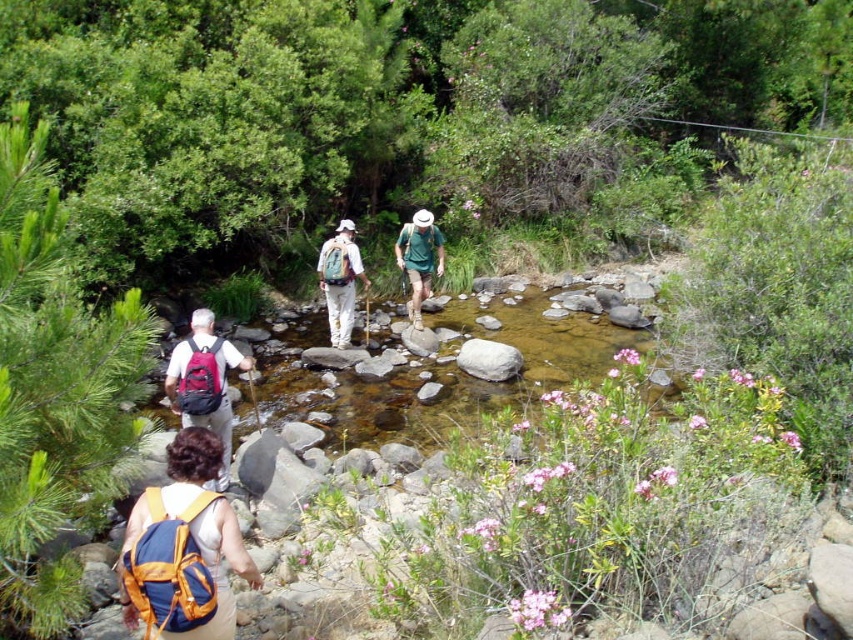
Is clear water at center to the left of white matte backpack at center from the viewer's perspective?

Incorrect, clear water at center is not on the left side of white matte backpack at center.

Describe the element at coordinates (442, 364) in the screenshot. I see `clear water at center` at that location.

This screenshot has width=853, height=640. I want to click on clear water at center, so [442, 364].

Between matte red backpack at center and white matte backpack at center, which one is positioned higher?

Positioned higher is white matte backpack at center.

Find the location of a particular element. The height and width of the screenshot is (640, 853). matte red backpack at center is located at coordinates (204, 381).

Who is more forward, (x=218, y=429) or (x=354, y=272)?

Point (x=218, y=429) is in front.

At what (x,y) coordinates should I click in order to perform the action: click on matte red backpack at center. Please return your answer as a coordinate pair (x, y). The width and height of the screenshot is (853, 640). Looking at the image, I should click on (204, 381).

Between blue fabric backpack at lower left and matte red backpack at center, which one is positioned higher?

matte red backpack at center

Does blue fabric backpack at lower left have a lesser height compared to matte red backpack at center?

Indeed, blue fabric backpack at lower left has a lesser height compared to matte red backpack at center.

Between point (141, 608) and point (189, 340), which one is positioned behind?

The point (189, 340) is more distant.

Where is `blue fabric backpack at lower left`? blue fabric backpack at lower left is located at coordinates (189, 538).